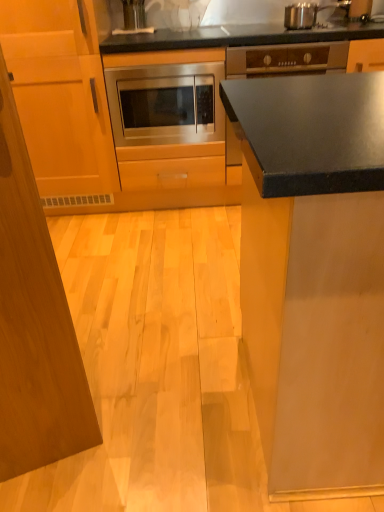
Question: Is stainless steel microwave at center taller or shorter than wooden cabinet at left, which is counted as the 1th cabinetry, starting from the left?

Choices:
 (A) tall
 (B) short

Answer: (B)

Question: From a real-world perspective, relative to wooden cabinet at left, which is counted as the 1th cabinetry, starting from the left, is stainless steel microwave at center vertically above or below?

Choices:
 (A) below
 (B) above

Answer: (B)

Question: Based on their relative distances, which object is farther from the stainless steel microwave at center, which is the 2th cabinetry from left to right?

Choices:
 (A) matte black countertop at upper right
 (B) stainless steel microwave at center
 (C) wooden cabinet at left, which is the 2th cabinetry from right to left

Answer: (A)

Question: Which of these objects is positioned farthest from the wooden cabinet at left, which is the 2th cabinetry from right to left?

Choices:
 (A) stainless steel microwave at center
 (B) matte black countertop at upper right
 (C) stainless steel microwave at center, which is the 2th cabinetry from left to right

Answer: (B)